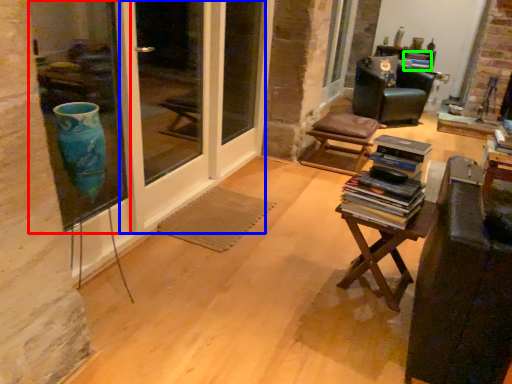
Question: Estimate the real-world distances between objects in this image. Which object is closer to window (highlighted by a red box), screen door (highlighted by a blue box) or book (highlighted by a green box)?

Choices:
 (A) screen door
 (B) book

Answer: (A)